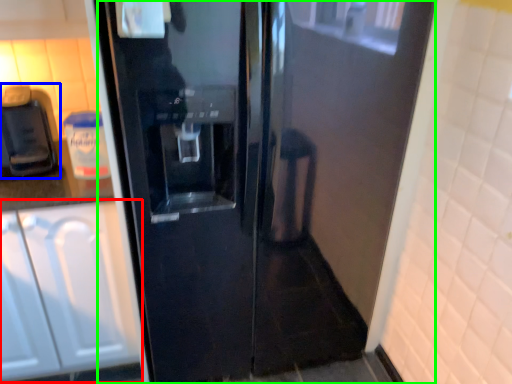
Question: Based on their relative distances, which object is farther from cabinetry (highlighted by a red box)? Choose from coffee machine (highlighted by a blue box) and door (highlighted by a green box).

Choices:
 (A) coffee machine
 (B) door

Answer: (B)